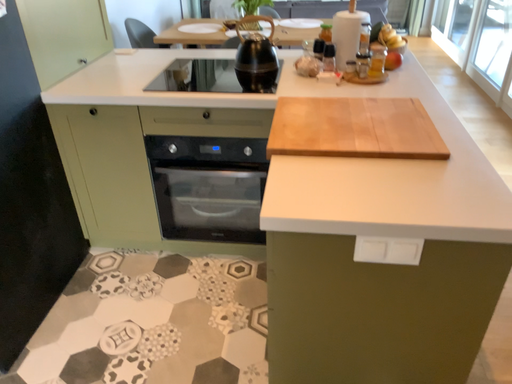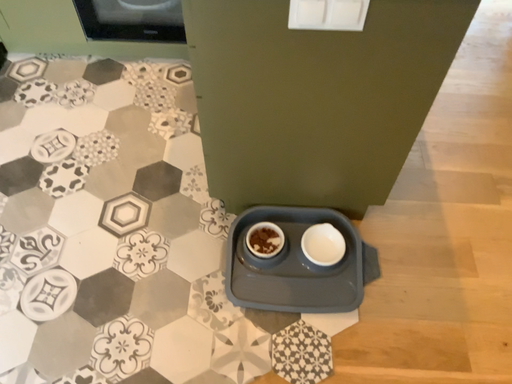
Question: How did the camera likely rotate when shooting the video?

Choices:
 (A) rotated upward
 (B) rotated downward

Answer: (B)